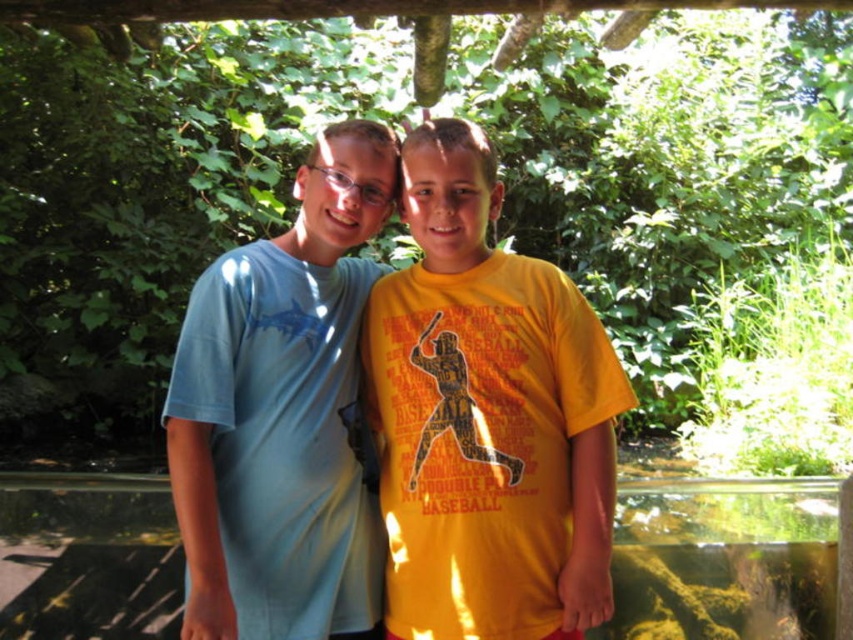
Which is more to the right, yellow cotton t-shirt at center or light blue cotton shirt at left?

yellow cotton t-shirt at center is more to the right.

Who is higher up, yellow cotton t-shirt at center or light blue cotton shirt at left?

light blue cotton shirt at left is above.

Which is behind, point (465, 232) or point (316, 163)?

Positioned behind is point (316, 163).

Identify the location of yellow cotton t-shirt at center. The height and width of the screenshot is (640, 853). (486, 417).

Between yellow cotton t-shirt at center and transparent glass water at center, which one is positioned higher?

yellow cotton t-shirt at center

Is point (432, 193) farther from viewer compared to point (79, 592)?

That is False.

I want to click on yellow cotton t-shirt at center, so click(x=486, y=417).

Can you confirm if light blue cotton shirt at left is positioned above transparent glass water at center?

Correct, light blue cotton shirt at left is located above transparent glass water at center.

How distant is light blue cotton shirt at left from transparent glass water at center?

light blue cotton shirt at left and transparent glass water at center are 1.90 meters apart from each other.

Who is more distant from viewer, (x=183, y=368) or (x=54, y=536)?

The point (x=54, y=536) is behind.

The width and height of the screenshot is (853, 640). I want to click on light blue cotton shirt at left, so click(x=282, y=413).